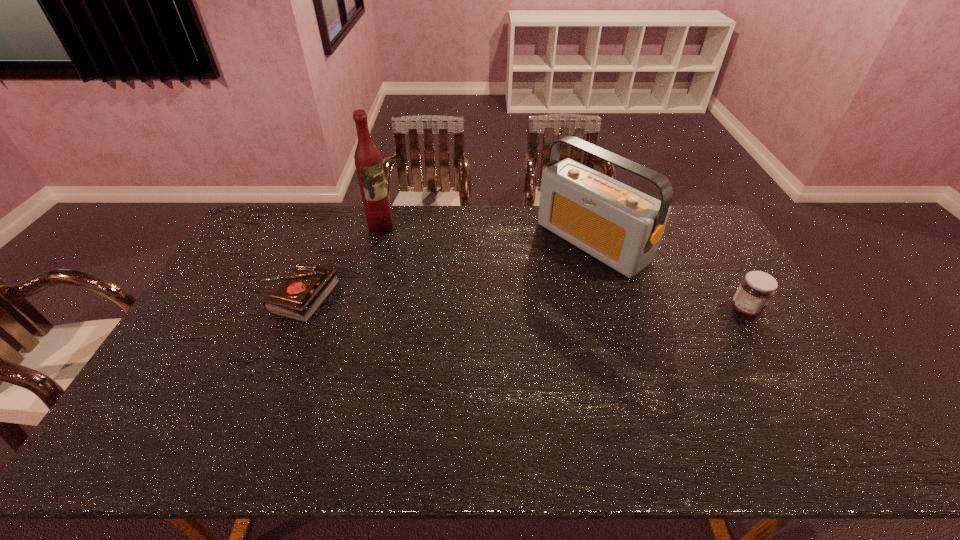
What are the coordinates of `free space located on the label of the second object from left to right` in the screenshot? It's located at 410,256.

Identify the location of vacant space situated 0.180m on the label of the second object from left to right. coord(413,259).

Identify the location of vacant space located 0.220m on the front-facing side of the radio receiver. The height and width of the screenshot is (540, 960). (512, 298).

Locate an element on the screen. free space located 0.060m on the front-facing side of the radio receiver is located at coordinates [546, 275].

Where is `vacant space located 0.220m on the front-facing side of the radio receiver`? The image size is (960, 540). vacant space located 0.220m on the front-facing side of the radio receiver is located at coordinates (512, 298).

Locate an element on the screen. This screenshot has width=960, height=540. liquor present at the far edge is located at coordinates (368, 161).

Find the location of a particular element. The image size is (960, 540). radio receiver that is at the far edge is located at coordinates (622, 227).

Image resolution: width=960 pixels, height=540 pixels. In order to click on object that is positioned at the right edge in this screenshot , I will do `click(755, 291)`.

You are a GUI agent. You are given a task and a screenshot of the screen. Output one action in this format:
    pyautogui.click(x=<x>, y=<y>)
    Task: Click on the blank space at the far edge
    The width and height of the screenshot is (960, 540).
    Given the screenshot: What is the action you would take?
    pyautogui.click(x=470, y=235)

You are a GUI agent. You are given a task and a screenshot of the screen. Output one action in this format:
    pyautogui.click(x=<x>, y=<y>)
    Task: Click on the free spot at the left edge of the desktop
    
    Given the screenshot: What is the action you would take?
    pyautogui.click(x=267, y=273)